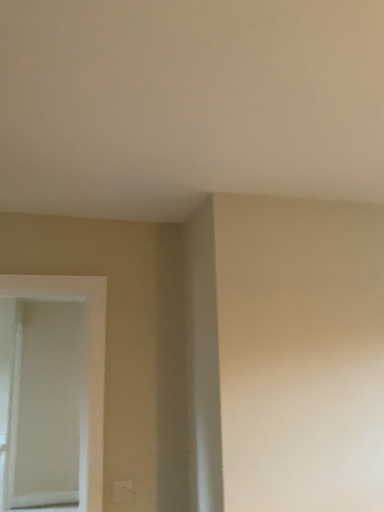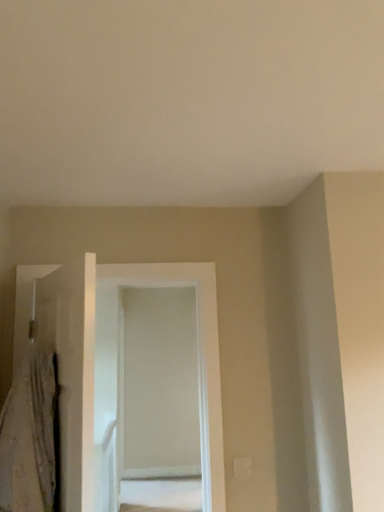
Question: Which way did the camera rotate in the video?

Choices:
 (A) rotated right
 (B) rotated left

Answer: (B)